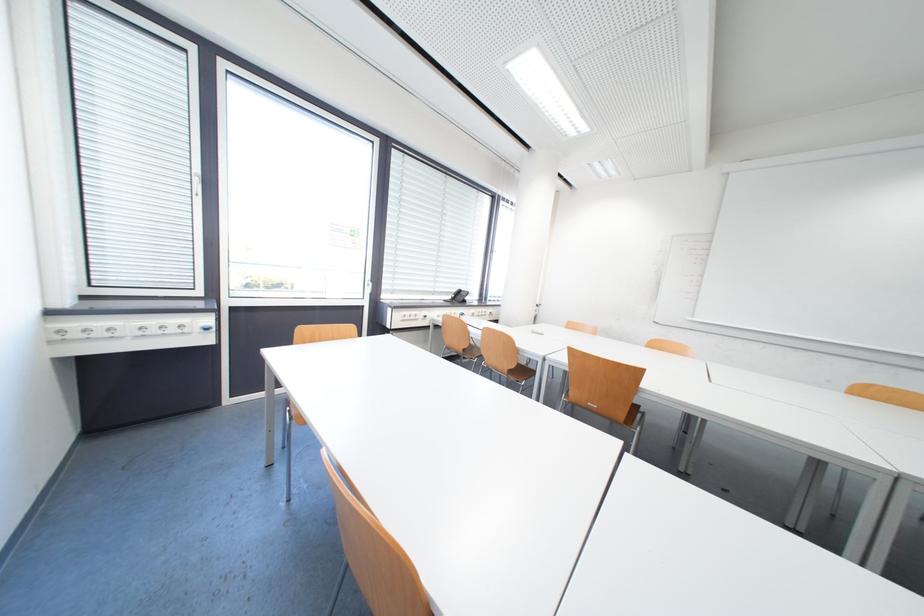
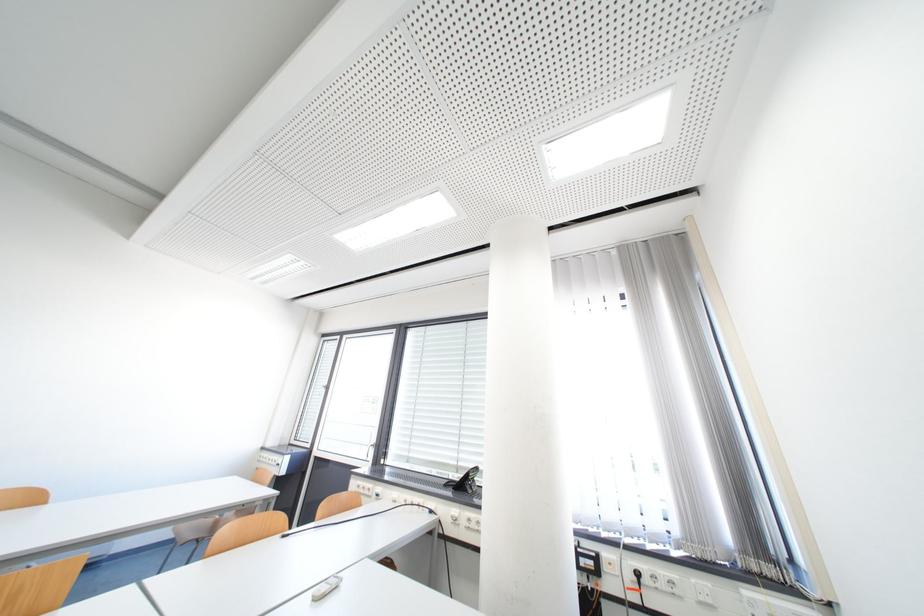
In the second image, find the point that corresponds to (463,300) in the first image.

(478, 483)